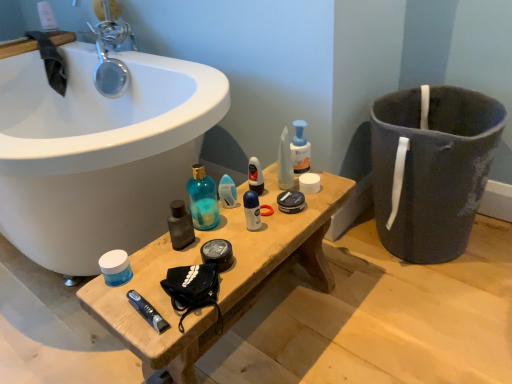
This screenshot has width=512, height=384. In order to click on free space in front of translucent plastic bottle at center, the first mouthwash positioned from the top in this screenshot , I will do `click(306, 196)`.